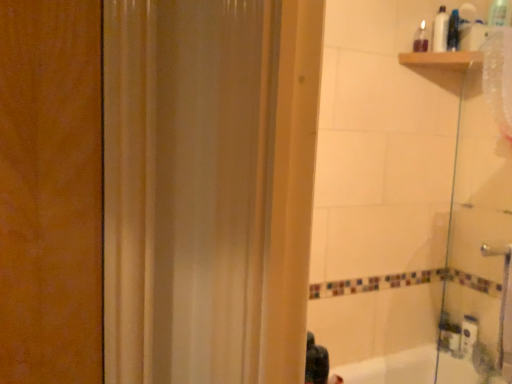
Question: In terms of size, does black matte hair at lower center appear bigger or smaller than white plastic bottle at upper right, acting as the 2th toiletry starting from the right?

Choices:
 (A) small
 (B) big

Answer: (A)

Question: From a real-world perspective, is black matte hair at lower center physically located above or below white plastic bottle at upper right, acting as the 2th toiletry starting from the right?

Choices:
 (A) below
 (B) above

Answer: (A)

Question: Estimate the real-world distances between objects in this image. Which object is farther from the black matte hair at lower center?

Choices:
 (A) transparent glass shower door at right
 (B) translucent plastic bottle at upper right, positioned as the 3th toiletry in right-to-left order
 (C) translucent plastic bottle at upper right, positioned as the third toiletry in left-to-right order
 (D) white plastic bottle at upper right, the second toiletry when ordered from left to right

Answer: (C)

Question: Based on their relative distances, which object is nearer to the white plastic bottle at upper right, the second toiletry when ordered from left to right?

Choices:
 (A) transparent glass shower door at right
 (B) translucent plastic bottle at upper right, the first toiletry positioned from the left
 (C) translucent plastic bottle at upper right, the first toiletry in the right-to-left sequence
 (D) black matte hair at lower center

Answer: (C)